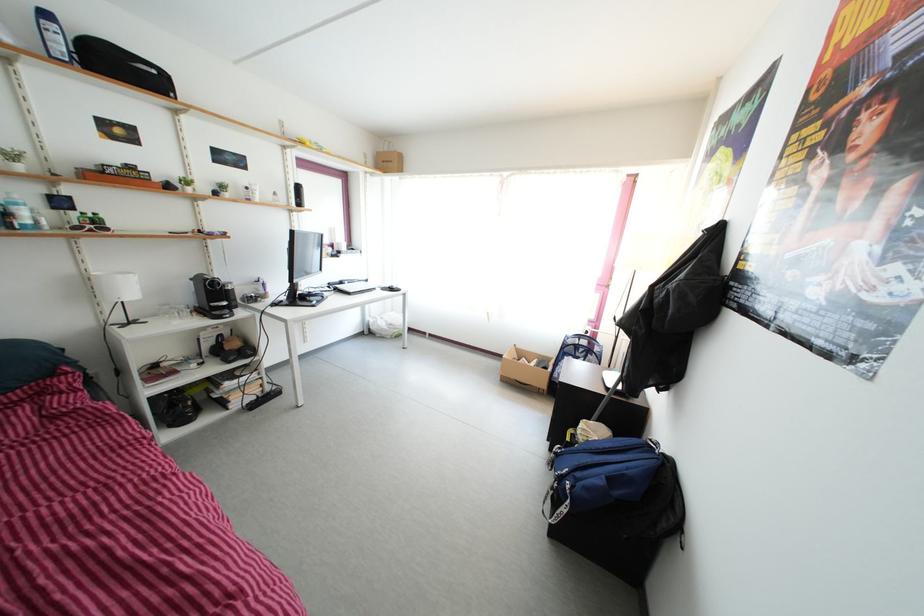
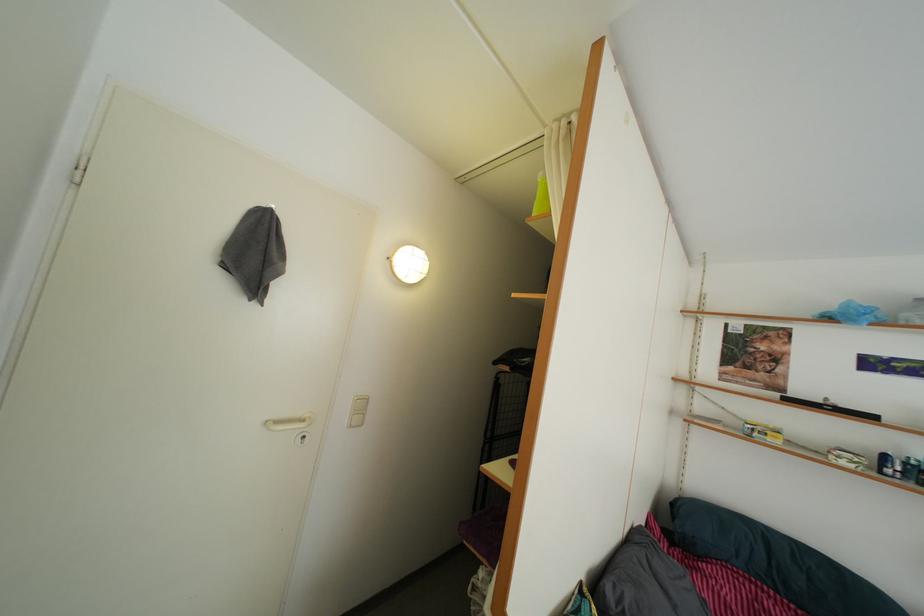
Question: The camera is either moving clockwise (left) or counter-clockwise (right) around the object. The first image is from the beginning of the video and the second image is from the end. Is the camera moving left or right when shooting the video?

Choices:
 (A) Left
 (B) Right

Answer: (B)